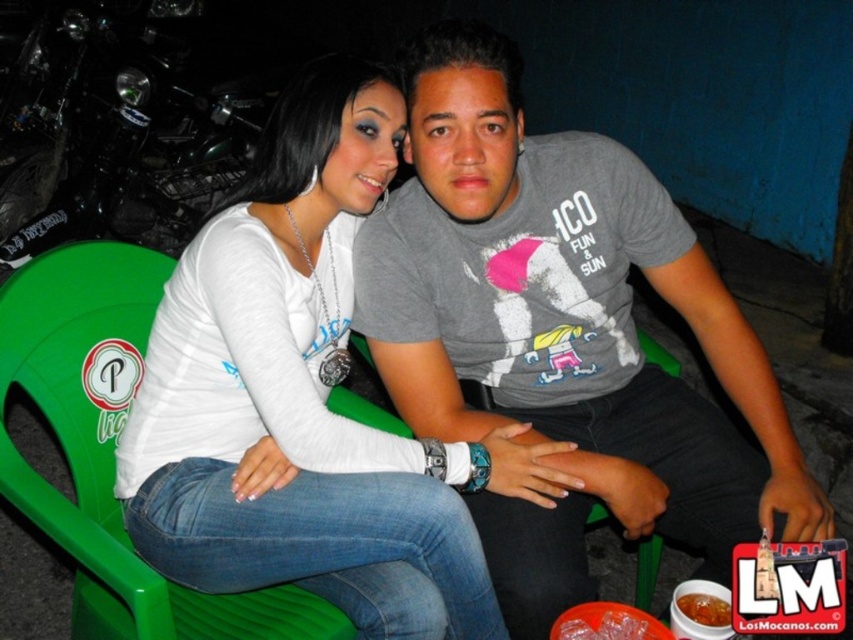
Does gray cotton t-shirt at center have a lesser height compared to green plastic chair at center?

Incorrect, gray cotton t-shirt at center's height does not fall short of green plastic chair at center's.

Who is positioned more to the right, gray cotton t-shirt at center or green plastic chair at center?

From the viewer's perspective, green plastic chair at center appears more on the right side.

Which is in front, point (744, 452) or point (648, 538)?

Positioned in front is point (744, 452).

Identify the location of gray cotton t-shirt at center. The height and width of the screenshot is (640, 853). (561, 332).

Is white matte shirt at center thinner than green plastic chair at left?

No, white matte shirt at center is not thinner than green plastic chair at left.

Between white matte shirt at center and green plastic chair at left, which one appears on the right side from the viewer's perspective?

white matte shirt at center is more to the right.

Is point (309, 150) more distant than point (88, 577)?

No, (309, 150) is in front of (88, 577).

Find the location of `white matte shirt at center`. white matte shirt at center is located at coordinates (305, 397).

Does green plastic chair at left have a larger size compared to green plastic chair at center?

Correct, green plastic chair at left is larger in size than green plastic chair at center.

Consider the image. Does green plastic chair at left have a greater height compared to green plastic chair at center?

Correct, green plastic chair at left is much taller as green plastic chair at center.

This screenshot has height=640, width=853. Identify the location of green plastic chair at left. (111, 449).

Find the location of a particular element. green plastic chair at left is located at coordinates (111, 449).